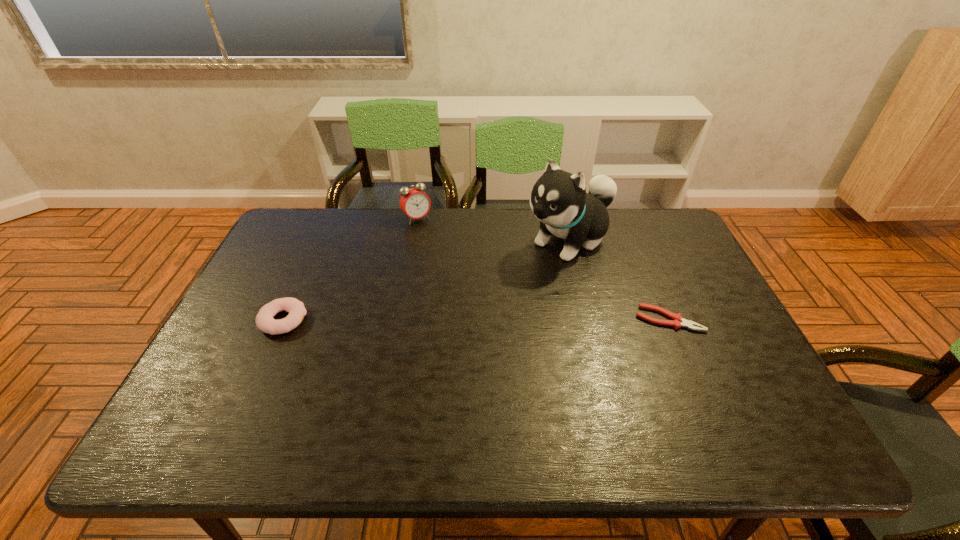
Find the location of a particular element. vacant area situated 0.110m at the face of the puppy is located at coordinates (516, 276).

Where is `vacant region located 0.330m on the front-facing side of the alarm clock`? vacant region located 0.330m on the front-facing side of the alarm clock is located at coordinates (468, 283).

I want to click on vacant space located 0.350m on the front-facing side of the alarm clock, so click(471, 287).

Locate an element on the screen. Image resolution: width=960 pixels, height=540 pixels. vacant region located 0.100m on the front-facing side of the alarm clock is located at coordinates (436, 241).

In order to click on puppy that is at the far edge in this screenshot , I will do `click(558, 199)`.

At what (x,y) coordinates should I click in order to perform the action: click on alarm clock at the far edge. Please return your answer as a coordinate pair (x, y). Image resolution: width=960 pixels, height=540 pixels. Looking at the image, I should click on (414, 202).

Locate an element on the screen. This screenshot has width=960, height=540. object that is at the left edge is located at coordinates (265, 322).

At what (x,y) coordinates should I click in order to perform the action: click on object located in the right edge section of the desktop. Please return your answer as a coordinate pair (x, y). This screenshot has height=540, width=960. Looking at the image, I should click on (678, 321).

Find the location of `free spot at the far edge of the desktop`. free spot at the far edge of the desktop is located at coordinates (433, 208).

This screenshot has height=540, width=960. In order to click on vacant space at the near edge of the desktop in this screenshot , I will do `click(528, 392)`.